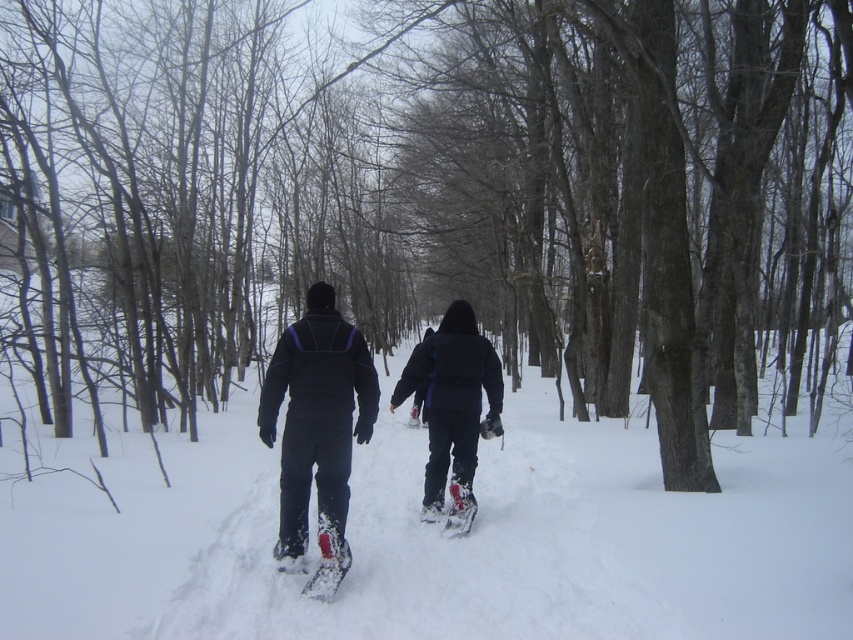
You are planning to take a photo of the dark blue snowsuit at center and the white rubber snowshoe at lower center. To ensure both are in the frame, should you adjust your camera to focus more to the right or left? Explain your reasoning based on their positions.

The dark blue snowsuit at center is positioned on the right side of the white rubber snowshoe at lower center. Therefore, to include both in the frame, you should adjust your camera to focus more to the left to capture the snowshoe at lower center and the snowsuit to its right.

You are a photographer trying to capture a clear photo of the dark blue snowsuit at center and the white rubber snowshoe at lower center. Given that your camera has a minimum focus distance of 20 inches, will you be able to focus on both subjects without moving closer?

The distance between the dark blue snowsuit at center and the white rubber snowshoe at lower center is 22.82 inches, which is greater than the camera minimum focus distance of 20 inches. Therefore, the camera can focus on both subjects without needing to move closer.